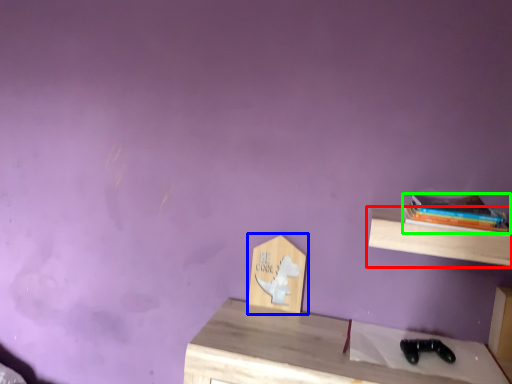
Question: Which object is the closest to the shelf (highlighted by a red box)? Choose among these: shelf (highlighted by a blue box) or book (highlighted by a green box).

Choices:
 (A) shelf
 (B) book

Answer: (B)